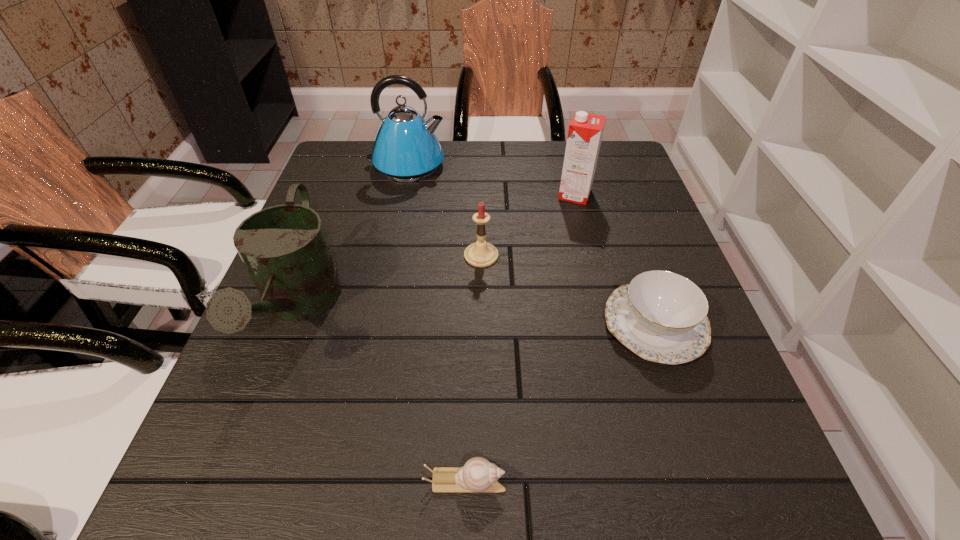
Locate an element on the screen. The width and height of the screenshot is (960, 540). unoccupied area between the kettle and the second shortest object is located at coordinates (531, 245).

In order to click on empty space between the second shortest object and the kettle in this screenshot , I will do `click(531, 245)`.

Where is `vacant area that lies between the watering can and the chinaware`? Image resolution: width=960 pixels, height=540 pixels. vacant area that lies between the watering can and the chinaware is located at coordinates (477, 316).

The image size is (960, 540). In order to click on blank region between the second shortest object and the carton in this screenshot , I will do `click(615, 259)`.

You are a GUI agent. You are given a task and a screenshot of the screen. Output one action in this format:
    pyautogui.click(x=<x>, y=<y>)
    Task: Click on the free space between the watering can and the shortest object
    The image size is (960, 540).
    Given the screenshot: What is the action you would take?
    pyautogui.click(x=382, y=395)

I want to click on free space that is in between the fourth tallest object and the kettle, so click(444, 211).

You are a GUI agent. You are given a task and a screenshot of the screen. Output one action in this format:
    pyautogui.click(x=<x>, y=<y>)
    Task: Click on the free space between the carton and the shortest object
    This screenshot has height=540, width=960.
    Given the screenshot: What is the action you would take?
    pyautogui.click(x=520, y=338)

You are a GUI agent. You are given a task and a screenshot of the screen. Output one action in this format:
    pyautogui.click(x=<x>, y=<y>)
    Task: Click on the empty space that is in between the carton and the candle
    
    Given the screenshot: What is the action you would take?
    pyautogui.click(x=528, y=225)

Locate an element on the screen. The image size is (960, 540). object that is the fourth nearest to the carton is located at coordinates (284, 248).

The image size is (960, 540). I want to click on the third closest object to the fifth tallest object, so click(585, 132).